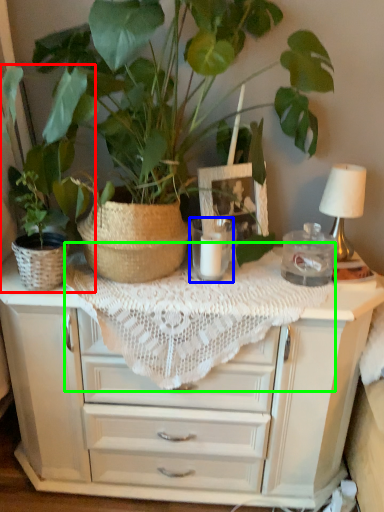
Question: Which object is positioned farthest from houseplant (highlighted by a red box)? Select from candle holder (highlighted by a blue box) and tablecloth (highlighted by a green box).

Choices:
 (A) candle holder
 (B) tablecloth

Answer: (A)